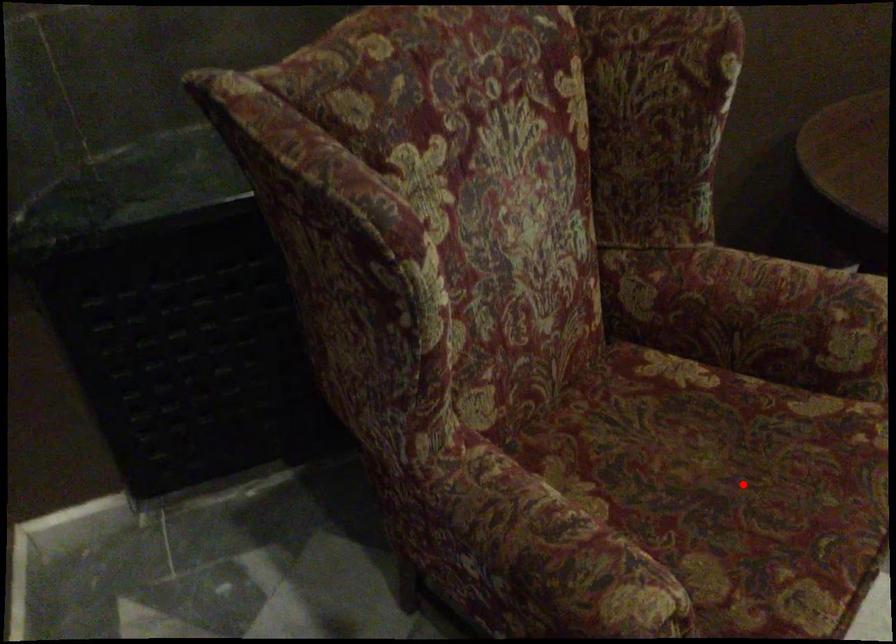
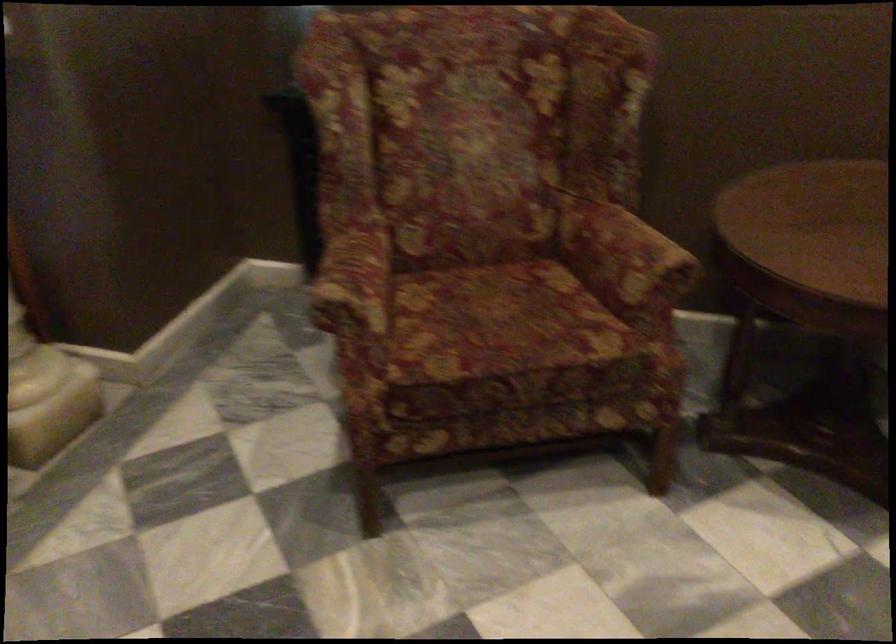
Question: I am providing you with two images of the same scene from different viewpoints. A red point is marked on the first image. Can you still see the location of the red point in image 2?

Choices:
 (A) Yes
 (B) No

Answer: (A)